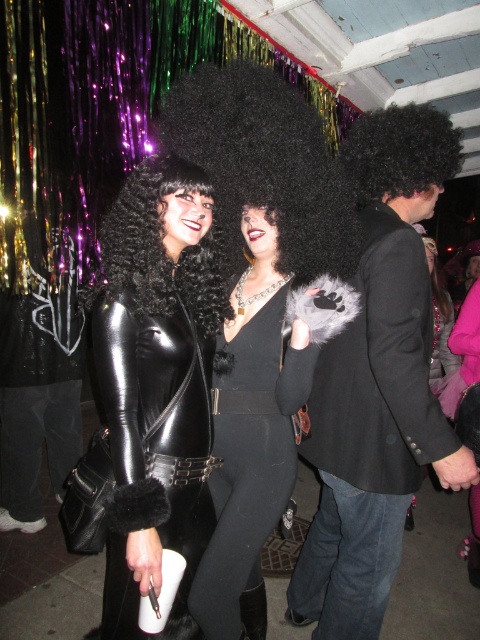
You are at a festive indoor event with a wooden ceiling and shiny tinsel decorations. You see two points marked in the image. The first point is at coordinates point (375, 621) and the second at point (192, 170). Which point is closer to you?

Point (192, 170) is closer to you because point (375, 621) is behind it.

You are organizing a costume party and need to decide which outfit to wear. You have the black leather jacket at center and the black velvet dress at center available. Considering their sizes, which one might be more suitable for someone who prefers a more voluminous and eye catching look?

The black leather jacket at center is larger in size than the black velvet dress at center, so it would be more suitable for someone who prefers a more voluminous and eye catching look.

Looking at this image, you are a photographer setting up a camera at the event. You want to focus on the two points in the scene, point (172, 260) and point (148, 305). Which point should you adjust your camera focus to first if you want to capture both points clearly in the same shot?

Point (172, 260) is further to the camera than point (148, 305). To capture both points clearly in the same shot, you should focus on the point that is further away, which is point (148, 305), as focusing on the further point can help ensure the closer point is also in focus.